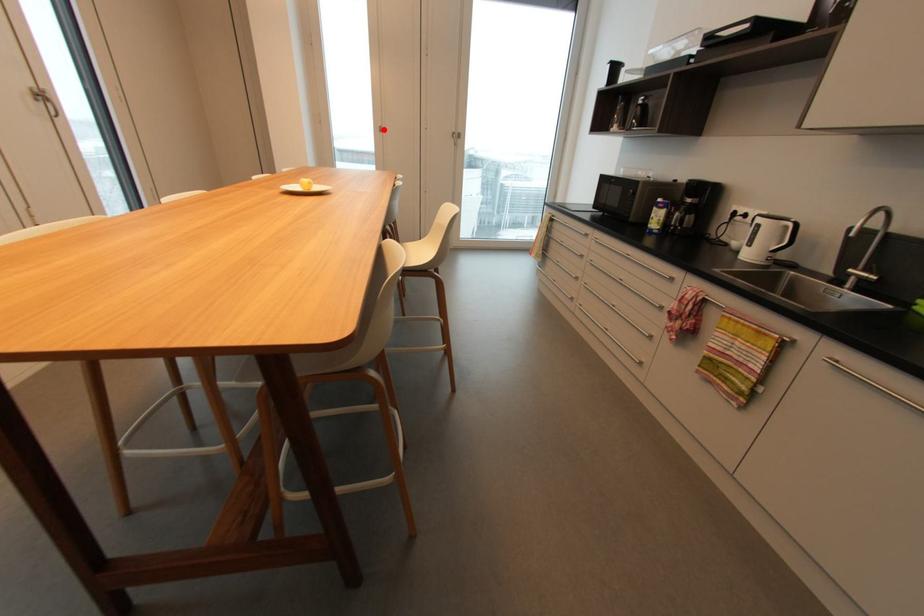
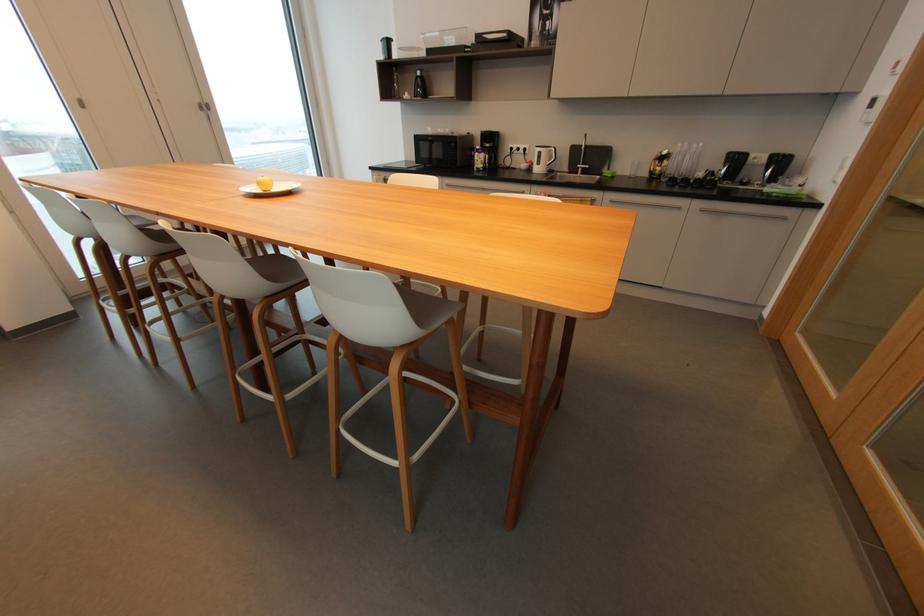
Question: I am providing you with two images of the same scene from different viewpoints. Image1 has a red point marked. In image2, the corresponding 3D location appears at what relative position? Reply with the corresponding letter.

Choices:
 (A) Closer
 (B) Farther

Answer: (A)